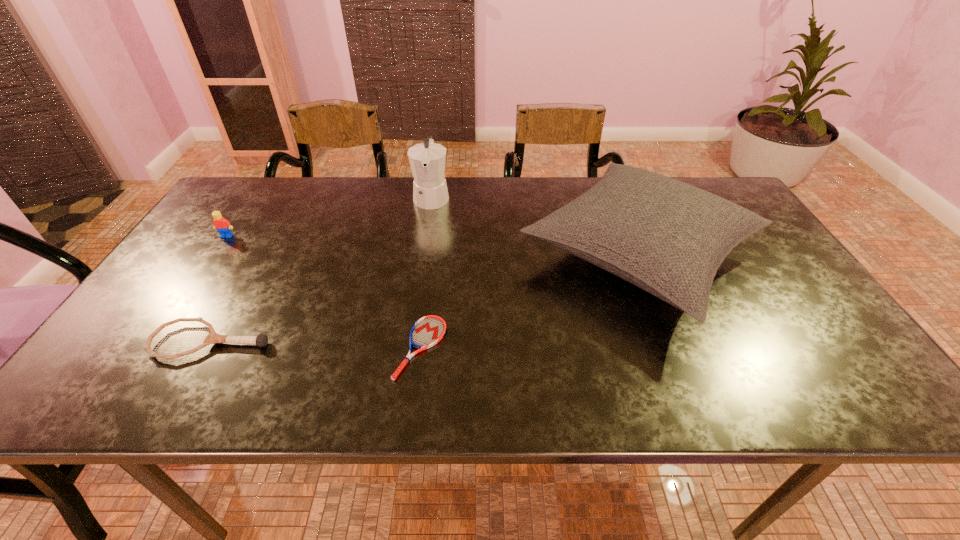
Find the location of `free space at the left edge`. free space at the left edge is located at coordinates (239, 233).

Identify the location of vacant area at the right edge. Image resolution: width=960 pixels, height=540 pixels. (787, 341).

This screenshot has width=960, height=540. What are the coordinates of `vacant space at the far left corner of the desktop` in the screenshot? It's located at 276,181.

Image resolution: width=960 pixels, height=540 pixels. I want to click on free space at the near left corner of the desktop, so click(x=71, y=406).

The height and width of the screenshot is (540, 960). I want to click on vacant space that's between the third shortest object and the fourth tallest object, so click(219, 289).

At what (x,y) coordinates should I click in order to perform the action: click on empty space that is in between the rightmost object and the third tallest object. Please return your answer as a coordinate pair (x, y). The height and width of the screenshot is (540, 960). Looking at the image, I should click on (433, 246).

You are a GUI agent. You are given a task and a screenshot of the screen. Output one action in this format:
    pyautogui.click(x=<x>, y=<y>)
    Task: Click on the vacant area that lies between the cushion and the Lego
    Image resolution: width=960 pixels, height=540 pixels.
    Given the screenshot: What is the action you would take?
    pyautogui.click(x=433, y=246)

Image resolution: width=960 pixels, height=540 pixels. Identify the location of free space between the third shortest object and the shortest object. (324, 292).

The width and height of the screenshot is (960, 540). What are the coordinates of `free space between the third tallest object and the cushion` in the screenshot? It's located at (433, 246).

Identify the location of vacant space that's between the right tennis racket and the taller tennis racket. (316, 345).